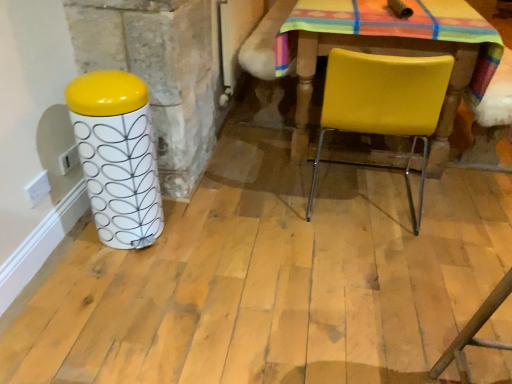
The image size is (512, 384). Identify the location of free region on the left part of white glossy patterned canister at left. (74, 240).